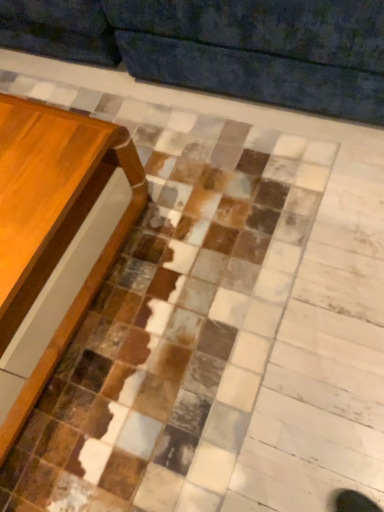
The width and height of the screenshot is (384, 512). Find the location of `free spot to the right of wooden table at left`. free spot to the right of wooden table at left is located at coordinates (196, 236).